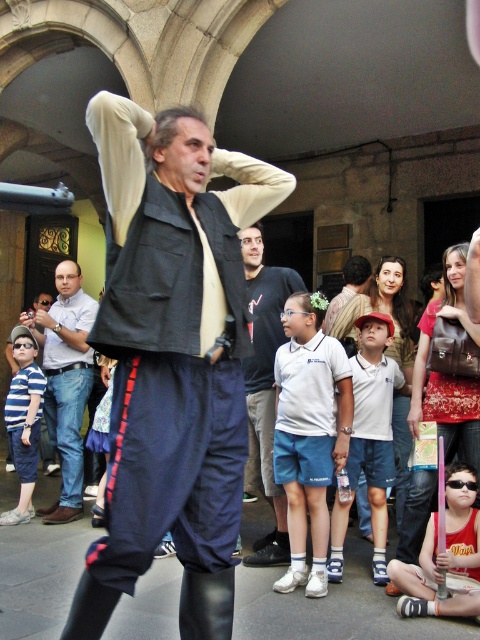
Does light blue jeans at center appear under white cotton shirt at center?

Incorrect, light blue jeans at center is not positioned below white cotton shirt at center.

This screenshot has height=640, width=480. Describe the element at coordinates (66, 381) in the screenshot. I see `light blue jeans at center` at that location.

Where is `light blue jeans at center`? The image size is (480, 640). light blue jeans at center is located at coordinates [x=66, y=381].

Can you confirm if matte black vest at center is positioned to the right of reddish-brown fabric shorts at lower right?

No, matte black vest at center is not to the right of reddish-brown fabric shorts at lower right.

Which is behind, point (190, 176) or point (467, 557)?

The point (467, 557) is behind.

Between point (145, 534) and point (431, 561), which one is positioned in front?

Positioned in front is point (145, 534).

The image size is (480, 640). I want to click on matte black vest at center, so click(x=171, y=358).

This screenshot has width=480, height=640. What do you see at coordinates (444, 556) in the screenshot?
I see `reddish-brown fabric shorts at lower right` at bounding box center [444, 556].

Which is above, reddish-brown fabric shorts at lower right or striped cotton shirt at center?

striped cotton shirt at center is higher up.

The width and height of the screenshot is (480, 640). I want to click on reddish-brown fabric shorts at lower right, so click(444, 556).